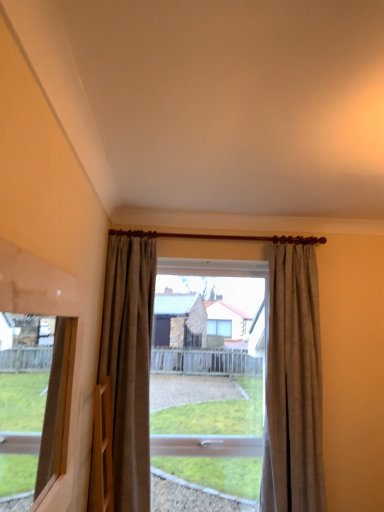
Question: Is transparent glass window at center wider or thinner than wooden frame at left?

Choices:
 (A) thin
 (B) wide

Answer: (B)

Question: From the image's perspective, is transparent glass window at center positioned above or below wooden frame at left?

Choices:
 (A) above
 (B) below

Answer: (B)

Question: Estimate the real-world distances between objects in this image. Which object is closer to the beige textured curtain at center, acting as the 1th curtain starting from the right?

Choices:
 (A) matte brown curtain at center, positioned as the second curtain in right-to-left order
 (B) transparent glass window at center
 (C) wooden frame at left

Answer: (A)

Question: Which object is the closest to the beige textured curtain at center, which appears as the second curtain when viewed from the left?

Choices:
 (A) matte brown curtain at center, positioned as the second curtain in right-to-left order
 (B) transparent glass window at center
 (C) wooden frame at left

Answer: (A)